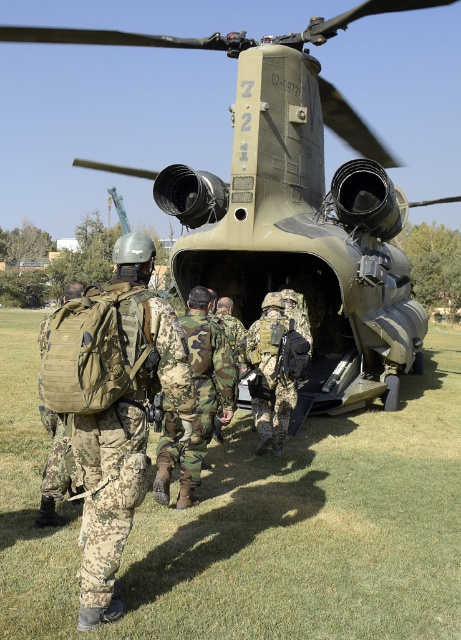
How distant is matte green helicopter at center from camouflage fabric backpack at left?

The distance of matte green helicopter at center from camouflage fabric backpack at left is 5.28 meters.

Does matte green helicopter at center appear under camouflage fabric backpack at left?

No.

Is point (371, 278) closer to camera compared to point (64, 481)?

No, it is behind (64, 481).

The width and height of the screenshot is (461, 640). What are the coordinates of `matte green helicopter at center` in the screenshot? It's located at (289, 192).

Can you confirm if camouflage fabric backpack at center is positioned to the left of camouflage fabric backpack at left?

Incorrect, camouflage fabric backpack at center is not on the left side of camouflage fabric backpack at left.

Between camouflage fabric backpack at center and camouflage fabric backpack at left, which one is positioned lower?

camouflage fabric backpack at center

What do you see at coordinates (113, 406) in the screenshot? Image resolution: width=461 pixels, height=640 pixels. I see `camouflage fabric backpack at center` at bounding box center [113, 406].

This screenshot has height=640, width=461. Identify the location of camouflage fabric backpack at center. (113, 406).

Is matte green helicopter at center taller than camouflage fabric backpack at center?

Indeed, matte green helicopter at center has a greater height compared to camouflage fabric backpack at center.

Does matte green helicopter at center have a lesser height compared to camouflage fabric backpack at center?

In fact, matte green helicopter at center may be taller than camouflage fabric backpack at center.

What do you see at coordinates (289, 192) in the screenshot? I see `matte green helicopter at center` at bounding box center [289, 192].

The image size is (461, 640). What are the coordinates of `matte green helicopter at center` in the screenshot? It's located at (289, 192).